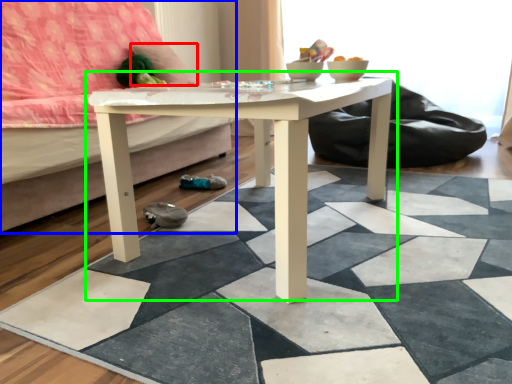
Question: Which object is the closest to the pillow (highlighted by a red box)? Choose among these: studio couch (highlighted by a blue box) or coffee table (highlighted by a green box).

Choices:
 (A) studio couch
 (B) coffee table

Answer: (A)